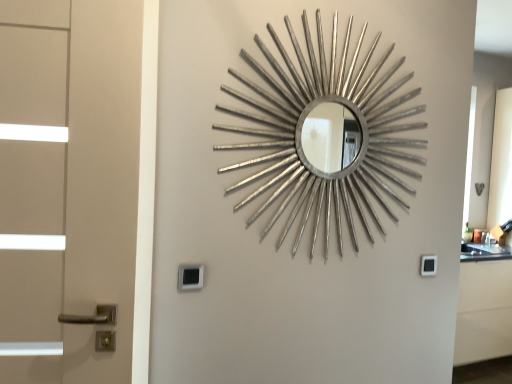
Question: Looking at their shapes, would you say black plastic lock at lower right, the 2th lock viewed from the front, is wider or thinner than silver metallic mirror at center?

Choices:
 (A) wide
 (B) thin

Answer: (B)

Question: Based on their sizes in the image, would you say black plastic lock at lower right, which is counted as the first lock, starting from the right, is bigger or smaller than silver metallic mirror at center?

Choices:
 (A) small
 (B) big

Answer: (A)

Question: Which object is the farthest from the black plastic lock at lower right, the 1th lock in the back-to-front sequence?

Choices:
 (A) silver metallic mirror at center
 (B) black plastic lock at lower center, the second lock in the right-to-left sequence

Answer: (B)

Question: Considering the real-world distances, which object is farthest from the black plastic lock at lower center, which appears as the 1th lock when viewed from the left?

Choices:
 (A) black plastic lock at lower right, which is the second lock from left to right
 (B) silver metallic mirror at center

Answer: (A)